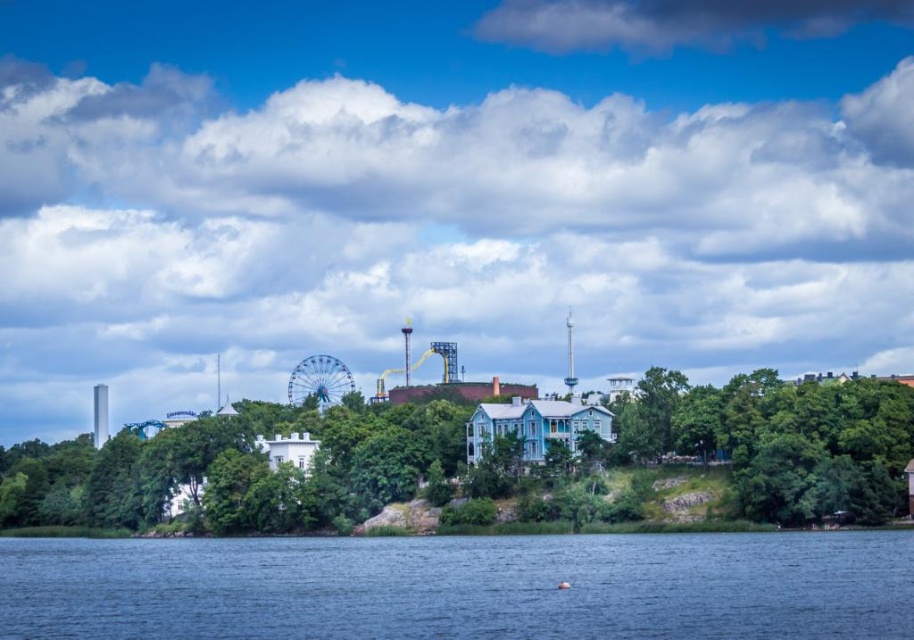
Question: Which object is the farthest from the green leafy trees at right?

Choices:
 (A) blue water at lower center
 (B) metallic ferris wheel at center

Answer: (A)

Question: Is blue water at lower center wider than green leafy trees at right?

Choices:
 (A) no
 (B) yes

Answer: (B)

Question: Which point is farther to the camera?

Choices:
 (A) blue water at lower center
 (B) green leafy trees at right
 (C) metallic ferris wheel at center

Answer: (C)

Question: Estimate the real-world distances between objects in this image. Which object is closer to the green leafy trees at right?

Choices:
 (A) metallic ferris wheel at center
 (B) blue water at lower center

Answer: (A)

Question: Is blue water at lower center to the left of green leafy trees at right from the viewer's perspective?

Choices:
 (A) no
 (B) yes

Answer: (B)

Question: Can you confirm if blue water at lower center is positioned to the right of green leafy trees at right?

Choices:
 (A) yes
 (B) no

Answer: (B)